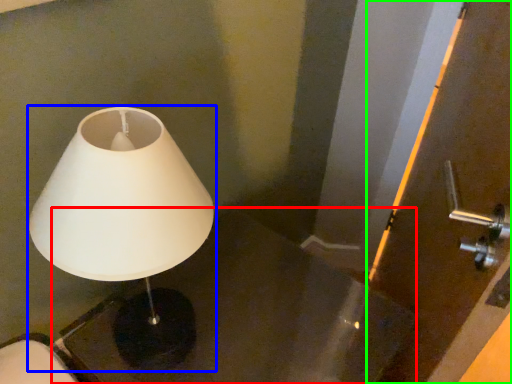
Question: Which is nearer to the table (highlighted by a red box)? lamp (highlighted by a blue box) or screen door (highlighted by a green box).

Choices:
 (A) lamp
 (B) screen door

Answer: (B)